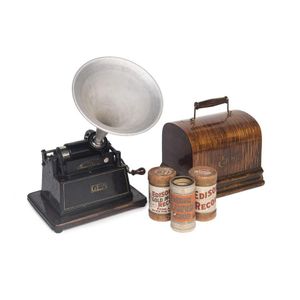
Where is `wooden cover`? The height and width of the screenshot is (300, 300). wooden cover is located at coordinates (231, 150).